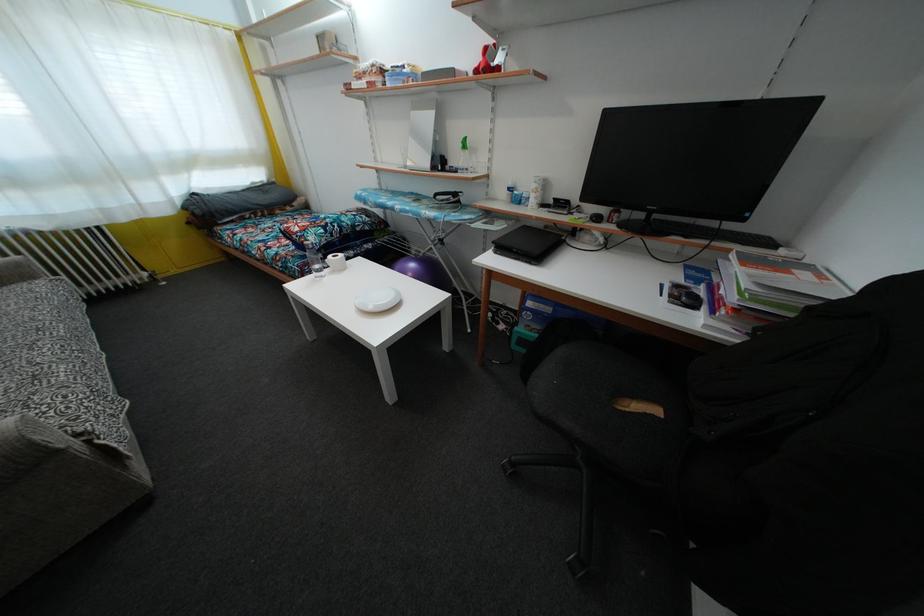
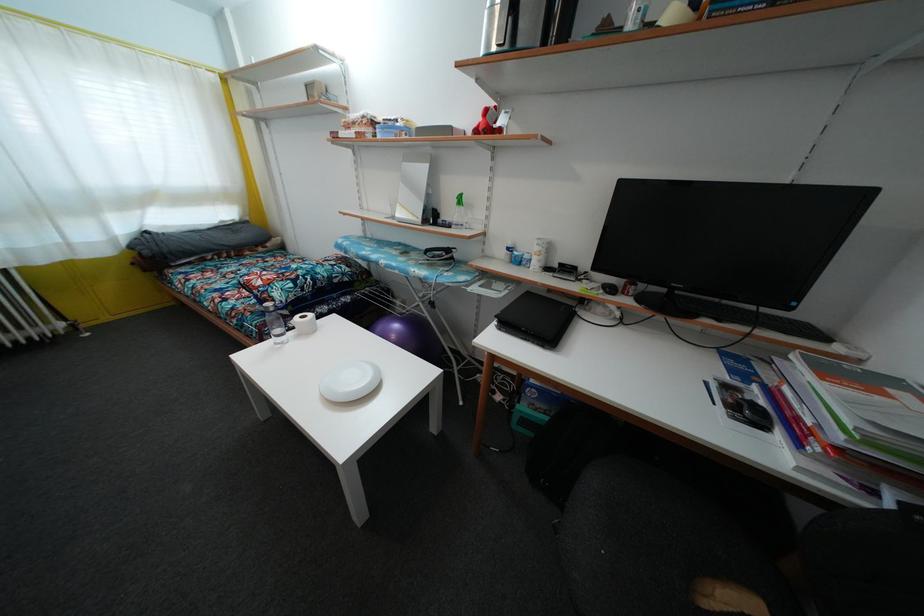
Locate, in the second image, the point that corresponds to the point at 419,113 in the first image.

(410, 164)